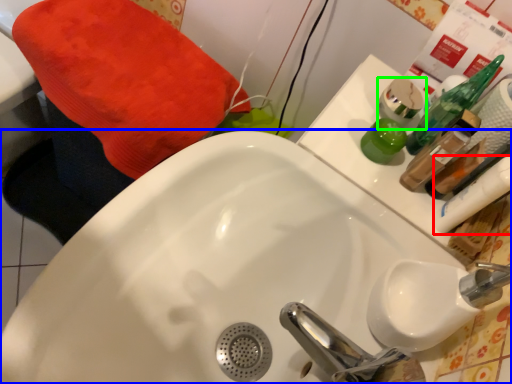
Question: Considering the real-world distances, which object is closest to mouthwash (highlighted by a red box)? sink (highlighted by a blue box) or mouthwash (highlighted by a green box).

Choices:
 (A) sink
 (B) mouthwash

Answer: (B)